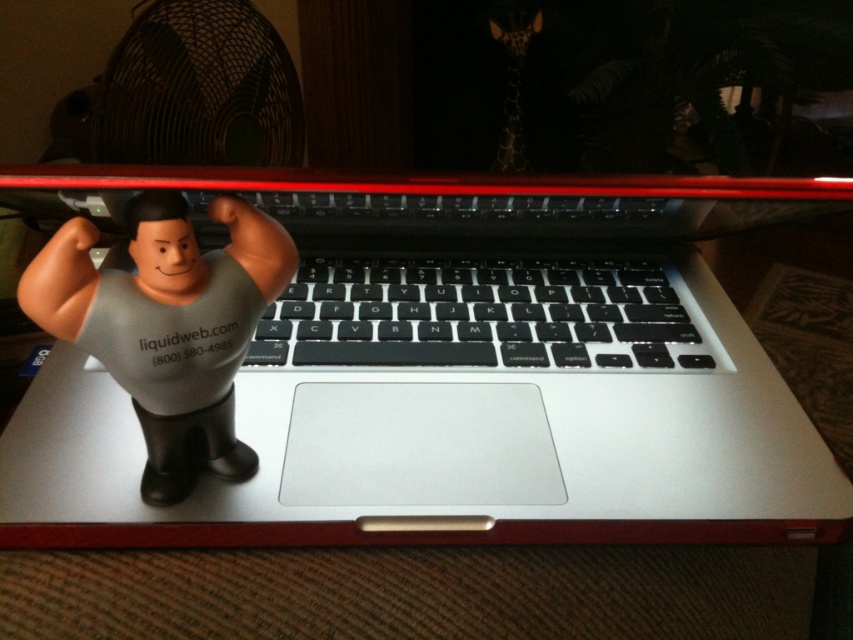
Question: Estimate the real-world distances between objects in this image. Which object is closer to the silver metallic laptop at center?

Choices:
 (A) rubber/soft toy at left
 (B) black matte keyboard at center

Answer: (B)

Question: Does rubber/soft toy at left appear on the right side of black matte keyboard at center?

Choices:
 (A) no
 (B) yes

Answer: (A)

Question: Does silver metallic laptop at center appear under rubber/soft toy at left?

Choices:
 (A) yes
 (B) no

Answer: (B)

Question: Does rubber/soft toy at left appear on the right side of black matte keyboard at center?

Choices:
 (A) yes
 (B) no

Answer: (B)

Question: Considering the real-world distances, which object is closest to the rubber/soft toy at left?

Choices:
 (A) spotted fur giraffe at upper center
 (B) silver metallic laptop at center
 (C) black matte keyboard at center

Answer: (B)

Question: Based on their relative distances, which object is farther from the spotted fur giraffe at upper center?

Choices:
 (A) silver metallic laptop at center
 (B) rubber/soft toy at left
 (C) black matte keyboard at center

Answer: (B)